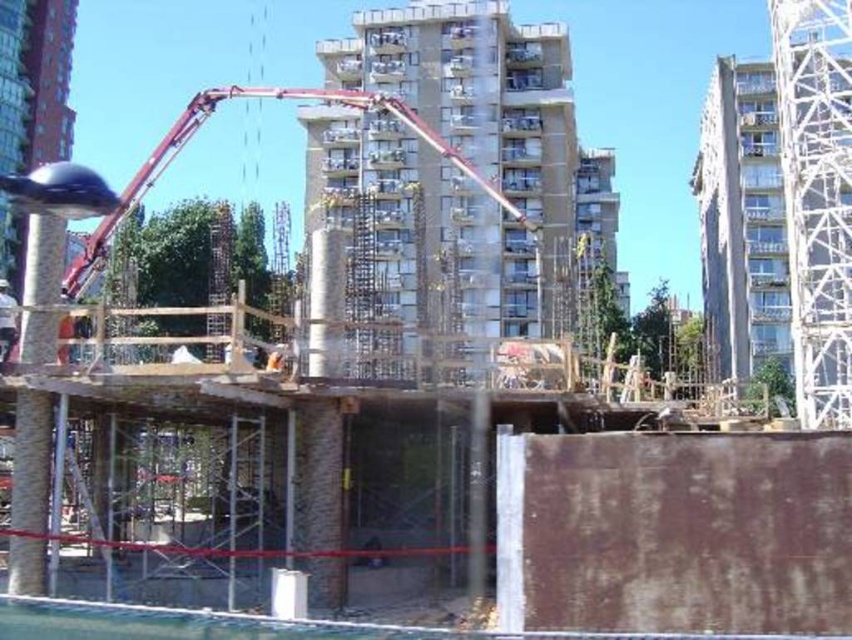
Looking at this image, who is lower down, concrete/rough concrete building at center or white metallic tower at upper right?

concrete/rough concrete building at center is below.

Which of these two, concrete/rough concrete building at center or white metallic tower at upper right, stands taller?

Standing taller between the two is concrete/rough concrete building at center.

Does point (475, 189) come in front of point (838, 134)?

No, (475, 189) is further to viewer.

I want to click on concrete/rough concrete building at center, so click(448, 179).

Can you confirm if white metallic tower at upper right is positioned to the left of smooth concrete building at right?

Yes, white metallic tower at upper right is to the left of smooth concrete building at right.

Does white metallic tower at upper right have a lesser height compared to smooth concrete building at right?

Yes.

I want to click on white metallic tower at upper right, so click(816, 196).

This screenshot has height=640, width=852. What are the coordinates of `white metallic tower at upper right` in the screenshot? It's located at (816, 196).

Is point (751, 269) positioned behind point (180, 145)?

Yes, point (751, 269) is farther from viewer.

Does point (761, 348) lie behind point (89, 273)?

Yes, point (761, 348) is behind point (89, 273).

The width and height of the screenshot is (852, 640). I want to click on smooth concrete building at right, so 741,225.